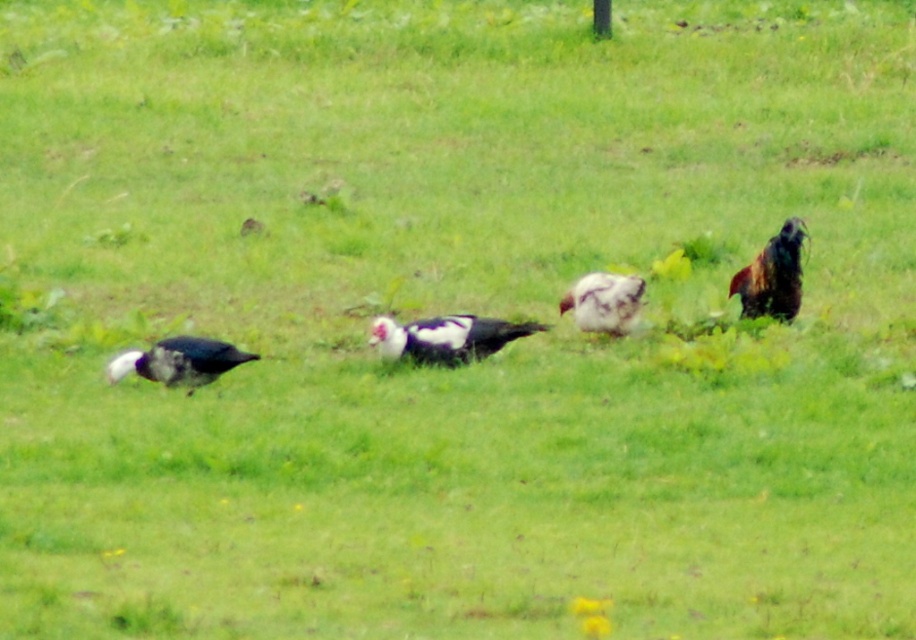
Question: Which of the following is the farthest from the observer?

Choices:
 (A) (144, 356)
 (B) (742, 276)
 (C) (473, 317)
 (D) (620, 288)

Answer: (B)

Question: Among these points, which one is nearest to the camera?

Choices:
 (A) (134, 372)
 (B) (766, 262)
 (C) (458, 362)
 (D) (609, 292)

Answer: (A)

Question: Which of the following is the farthest from the observer?

Choices:
 (A) (766, 304)
 (B) (602, 288)

Answer: (A)

Question: Does white glossy bird at left have a lesser width compared to multicolored feathered rooster at right?

Choices:
 (A) yes
 (B) no

Answer: (B)

Question: From the image, what is the correct spatial relationship of white glossy bird at left in relation to multicolored feathered rooster at right?

Choices:
 (A) below
 (B) above

Answer: (A)

Question: Does multicolored feathered rooster at right appear on the right side of white speckled feather at center?

Choices:
 (A) yes
 (B) no

Answer: (A)